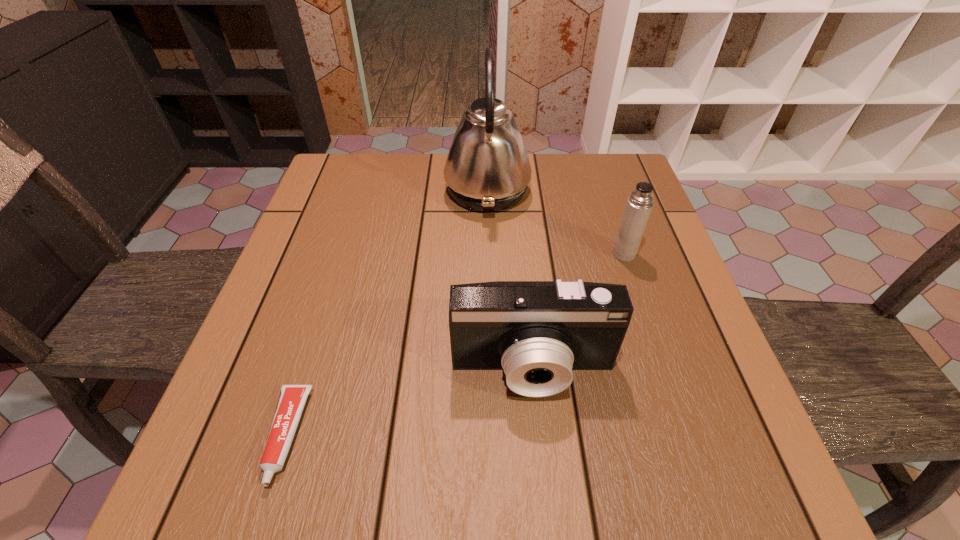
The width and height of the screenshot is (960, 540). I want to click on free space located 0.060m on the front of the rightmost object, so point(634,281).

Where is `free spot located on the lens of the camcorder`? This screenshot has height=540, width=960. free spot located on the lens of the camcorder is located at coordinates (541, 462).

Identify the location of object at the far edge. The height and width of the screenshot is (540, 960). (487, 169).

This screenshot has height=540, width=960. I want to click on object situated at the near edge, so click(x=292, y=399).

Find the location of a particular element. Image resolution: width=960 pixels, height=540 pixels. object at the left edge is located at coordinates (292, 399).

Find the location of a particular element. This screenshot has width=960, height=540. object present at the right edge is located at coordinates (639, 204).

Where is `object that is positioned at the near left corner`? This screenshot has height=540, width=960. object that is positioned at the near left corner is located at coordinates (292, 399).

I want to click on vacant space at the far edge of the desktop, so click(x=544, y=154).

Where is `vacant point at the near edge`? This screenshot has height=540, width=960. vacant point at the near edge is located at coordinates (323, 465).

Where is `free space at the left edge of the desktop`? free space at the left edge of the desktop is located at coordinates (354, 248).